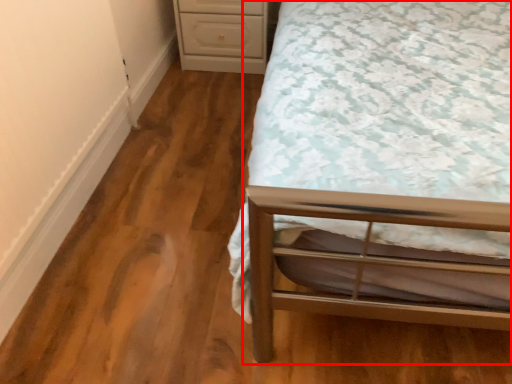
Question: From the image's perspective, where is bed (annotated by the red box) located relative to chest of drawers?

Choices:
 (A) below
 (B) above

Answer: (A)